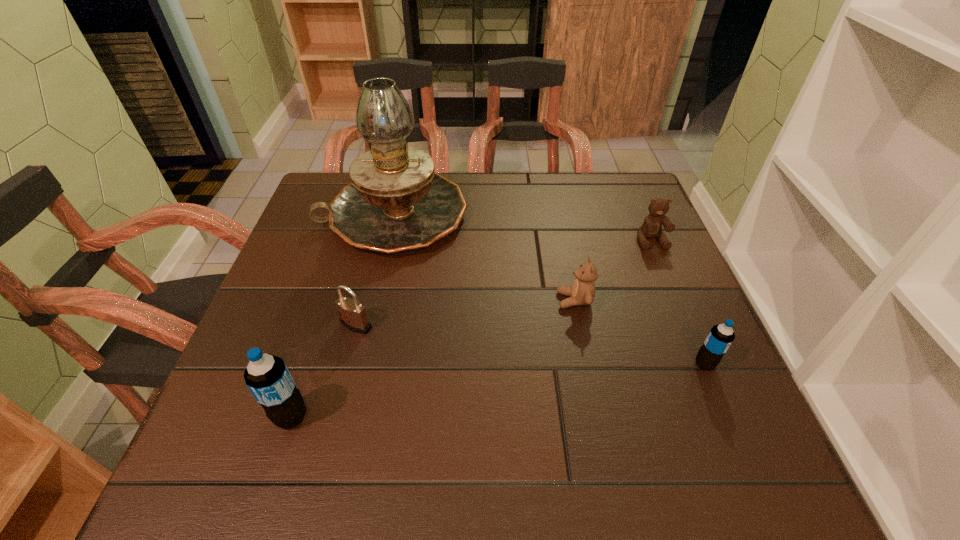
Where is `oil lamp located in the left edge section of the desktop`? This screenshot has height=540, width=960. oil lamp located in the left edge section of the desktop is located at coordinates (396, 202).

Image resolution: width=960 pixels, height=540 pixels. What are the coordinates of `soda bottle located in the right edge section of the desktop` in the screenshot? It's located at (721, 336).

Find the location of a particular element. This screenshot has height=540, width=960. teddy bear that is positioned at the right edge is located at coordinates (652, 227).

Identify the location of object located in the far left corner section of the desktop. (396, 202).

Locate an element on the screen. object positioned at the near left corner is located at coordinates (267, 377).

This screenshot has height=540, width=960. I want to click on vacant space at the far edge of the desktop, so click(x=547, y=187).

The width and height of the screenshot is (960, 540). What are the coordinates of `vacant region at the near edge of the desktop` in the screenshot? It's located at (482, 386).

Identify the location of vacant region at the left edge of the desktop. (310, 266).

The image size is (960, 540). I want to click on free location at the right edge of the desktop, so click(676, 353).

The image size is (960, 540). Find the location of `free space at the far right corner`. free space at the far right corner is located at coordinates (623, 203).